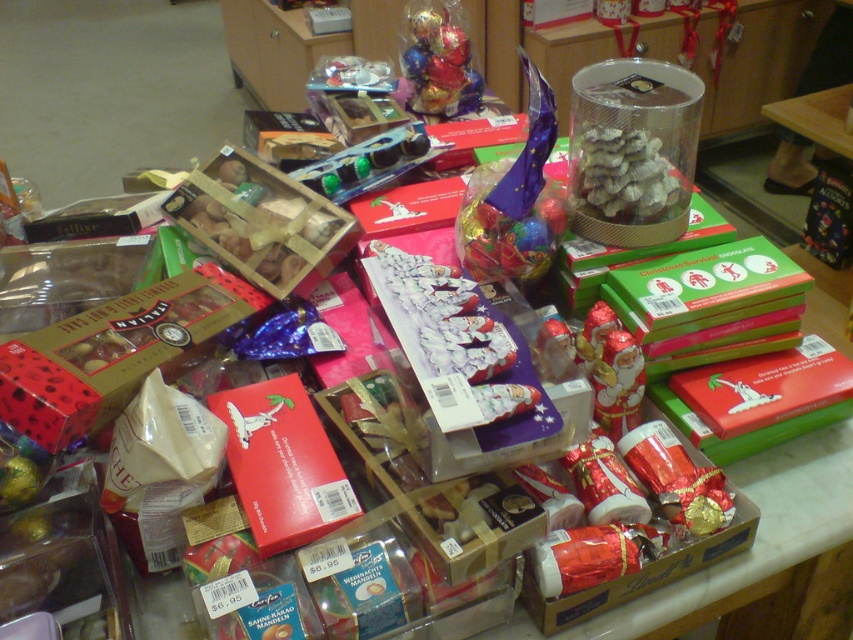
Can you confirm if shiny silver candy at center is taller than shiny foil wrapped chocolates at center?

In fact, shiny silver candy at center may be shorter than shiny foil wrapped chocolates at center.

Is point (598, 132) positioned after point (430, 74)?

No, it is not.

Where is `shiny silver candy at center`? shiny silver candy at center is located at coordinates (624, 177).